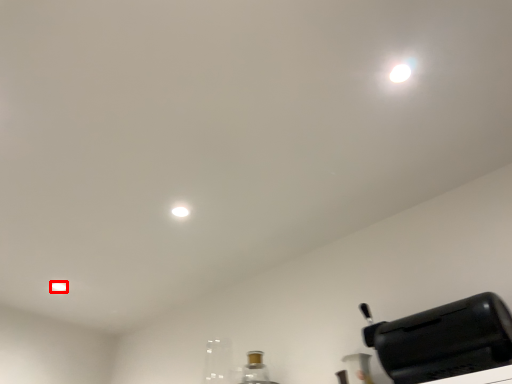
Question: From the image's perspective, what is the correct spatial relationship of dot (annotated by the red box) in relation to home appliance?

Choices:
 (A) above
 (B) below

Answer: (B)